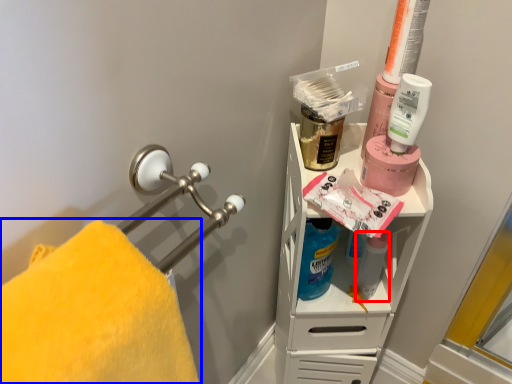
Question: Which object is further to the camera taking this photo, cleaning product (highlighted by a red box) or towel (highlighted by a blue box)?

Choices:
 (A) cleaning product
 (B) towel

Answer: (A)